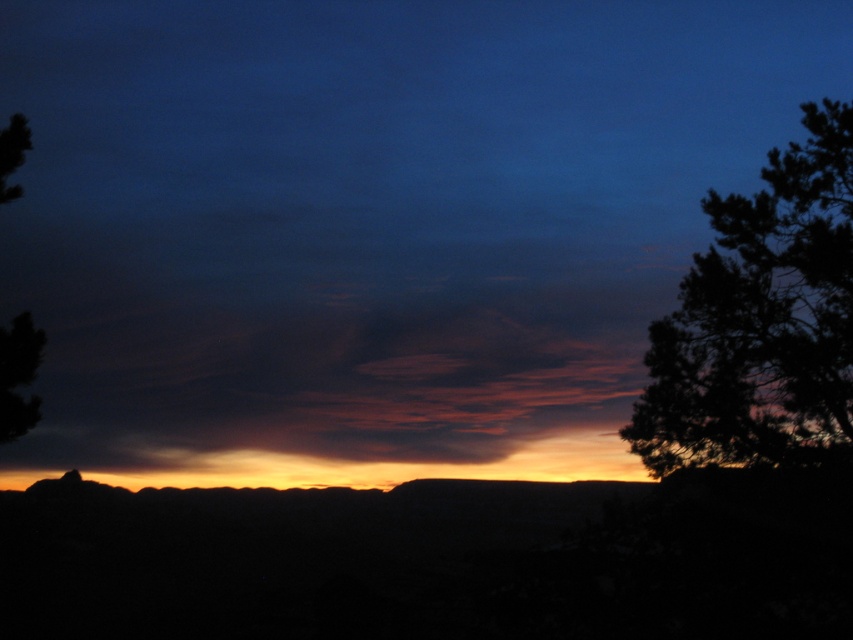
Is dark green textured tree at right below dark green leafy tree at left?

Actually, dark green textured tree at right is above dark green leafy tree at left.

Can you confirm if dark green textured tree at right is thinner than dark green leafy tree at left?

Incorrect, dark green textured tree at right's width is not less than dark green leafy tree at left's.

What do you see at coordinates (761, 317) in the screenshot?
I see `dark green textured tree at right` at bounding box center [761, 317].

The width and height of the screenshot is (853, 640). I want to click on dark green textured tree at right, so click(761, 317).